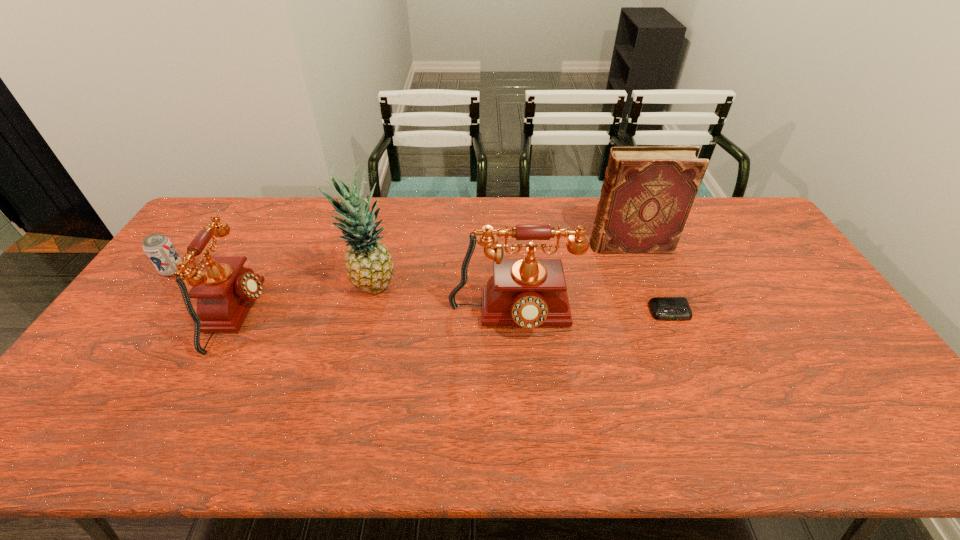
Identify the location of vacant area between the pineapple and the third shortest object. (305, 301).

Identify the location of unoccupied position between the pineapple and the left telephone. The height and width of the screenshot is (540, 960). (305, 301).

Where is `vacant space that is in between the second object from left to right and the taller telephone`? The width and height of the screenshot is (960, 540). vacant space that is in between the second object from left to right and the taller telephone is located at coordinates (375, 316).

Choose which object is the nearest neighbor to the hardback book. Please provide its 2D coordinates. Your answer should be formatted as a tuple, i.e. [(x, y)], where the tuple contains the x and y coordinates of a point satisfying the conditions above.

[(529, 292)]

Identify the location of object that stands as the fifth closest to the taller telephone. (159, 249).

Image resolution: width=960 pixels, height=540 pixels. Identify the location of vacant space that satisfies the following two spatial constraints: 1. on the spine side of the hardback book; 2. on the dial of the fourth object from left to right. (658, 318).

Where is `vacant area that satisfies the following two spatial constraints: 1. on the display of the alarm clock; 2. on the dial of the shorter telephone`? vacant area that satisfies the following two spatial constraints: 1. on the display of the alarm clock; 2. on the dial of the shorter telephone is located at coordinates (671, 315).

Find the location of a particular element. The image size is (960, 540). vacant space that satisfies the following two spatial constraints: 1. on the display of the alarm clock; 2. on the dial of the left telephone is located at coordinates (671, 315).